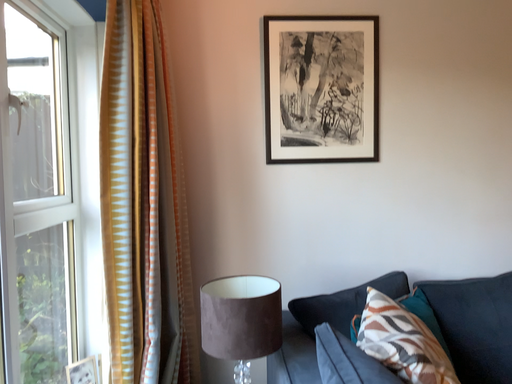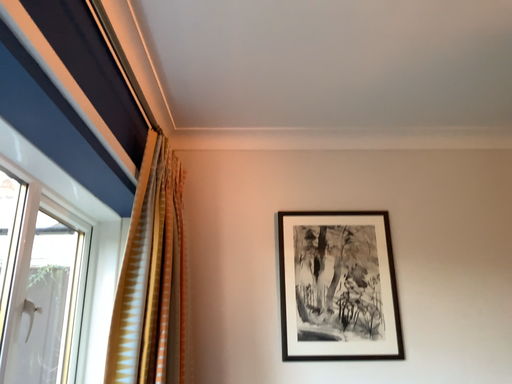
Question: How did the camera likely rotate when shooting the video?

Choices:
 (A) rotated upward
 (B) rotated downward

Answer: (A)